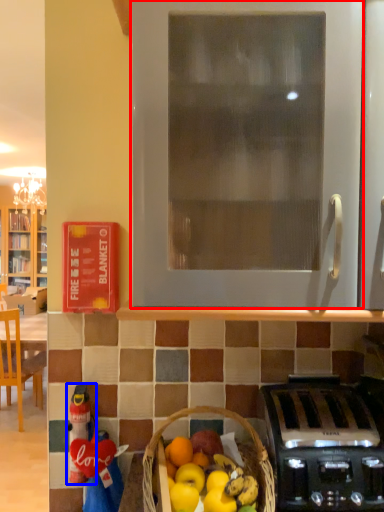
Question: Which object appears farthest to the camera in this image, oven (highlighted by a red box) or toy (highlighted by a blue box)?

Choices:
 (A) oven
 (B) toy

Answer: (B)